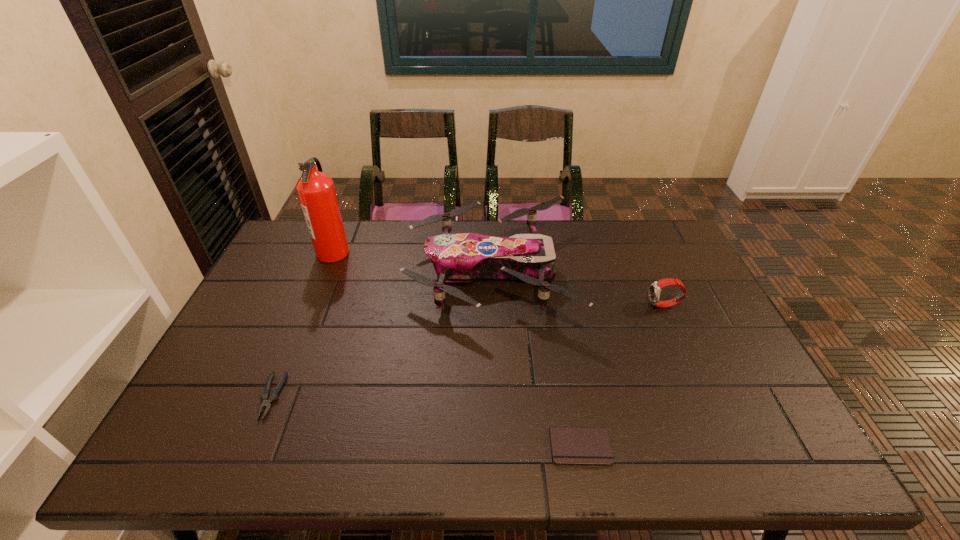
The height and width of the screenshot is (540, 960). I want to click on fire extinguisher, so click(316, 191).

Find the location of a particular element. The image size is (960, 540). drone is located at coordinates (459, 257).

Identify the location of the rightmost object. This screenshot has width=960, height=540. (655, 288).

Identify the location of the third tallest object. Image resolution: width=960 pixels, height=540 pixels. (655, 288).

Where is `the fourth farthest object`? This screenshot has width=960, height=540. the fourth farthest object is located at coordinates (267, 400).

I want to click on pliers, so click(267, 400).

The image size is (960, 540). Identify the location of the nearest object. (x=591, y=446).

Locate an element on the screen. This screenshot has width=960, height=540. the shortest object is located at coordinates (591, 446).

Image resolution: width=960 pixels, height=540 pixels. In order to click on vacant space located at the nozzle of the tallest object in this screenshot , I will do `click(446, 253)`.

Where is `vacant area located 0.320m on the front-facing side of the drone`? This screenshot has width=960, height=540. vacant area located 0.320m on the front-facing side of the drone is located at coordinates 308,273.